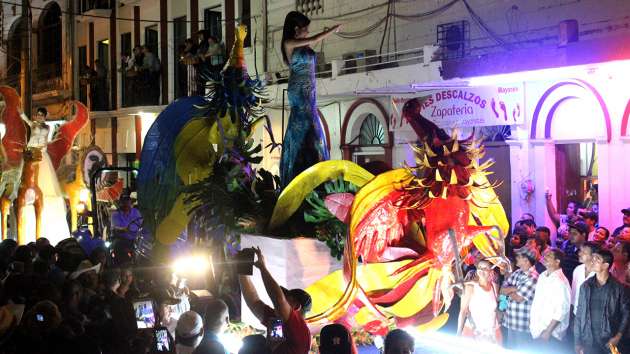
The width and height of the screenshot is (630, 354). Identify the location of phone. click(145, 312), click(248, 258), click(278, 328), click(161, 337).